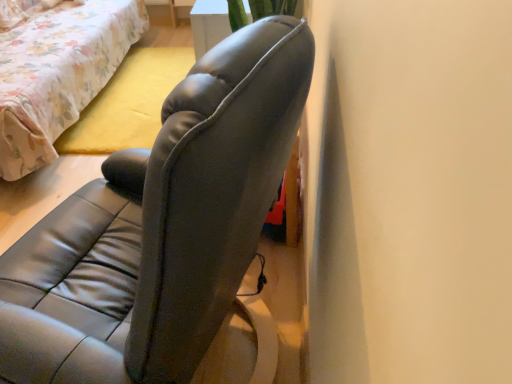
Question: From the image's perspective, relative to leather-like gray chair at center, is floral fabric bed at upper left above or below?

Choices:
 (A) below
 (B) above

Answer: (B)

Question: Is floral fabric bed at upper left in front of or behind leather-like gray chair at center in the image?

Choices:
 (A) front
 (B) behind

Answer: (B)

Question: Does point (46, 81) appear closer or farther from the camera than point (103, 208)?

Choices:
 (A) closer
 (B) farther

Answer: (B)

Question: Based on their positions, is leather-like gray chair at center located to the left or right of floral fabric bed at upper left?

Choices:
 (A) left
 (B) right

Answer: (B)

Question: Is point (116, 382) closer or farther from the camera than point (73, 41)?

Choices:
 (A) farther
 (B) closer

Answer: (B)

Question: Is leather-like gray chair at center inside the boundaries of floral fabric bed at upper left, or outside?

Choices:
 (A) inside
 (B) outside

Answer: (B)

Question: In the image, is leather-like gray chair at center positioned in front of or behind floral fabric bed at upper left?

Choices:
 (A) front
 (B) behind

Answer: (A)